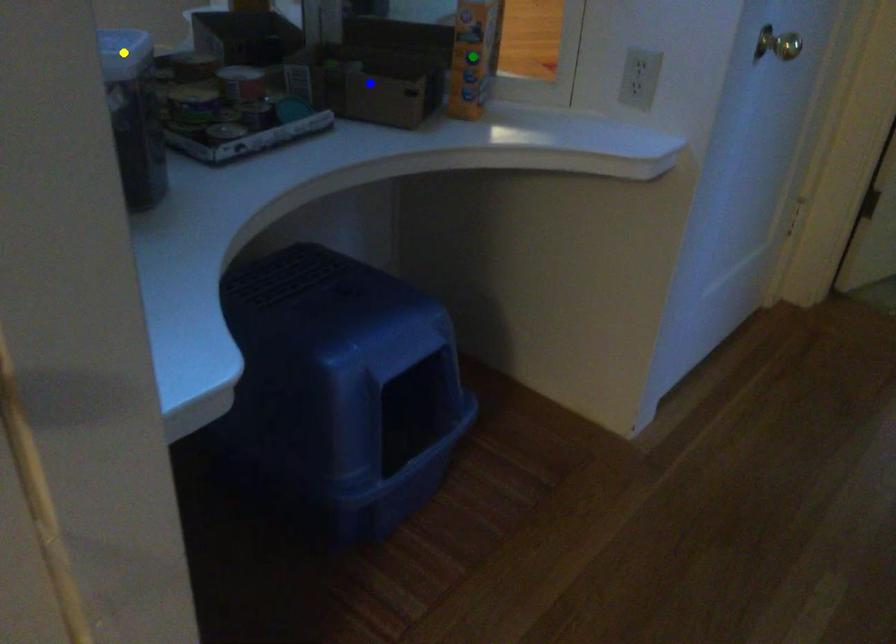
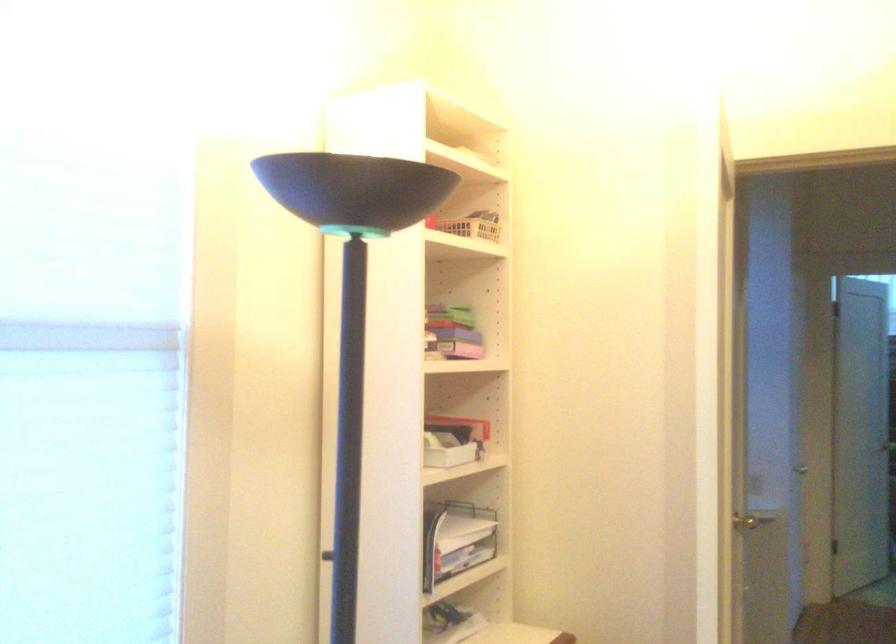
I am providing you with two images of the same scene from different viewpoints. Three points are marked in image1. Which point corresponds to a part or object that is occluded in image2?In image1, three points are marked. Which of them correspond to a part or object that is occluded in image2?Among the three points shown in image1, which one corresponds to a part or object that is no longer visible due to occlusion in image2?

Invisible in image2: blue point, yellow point, green point.